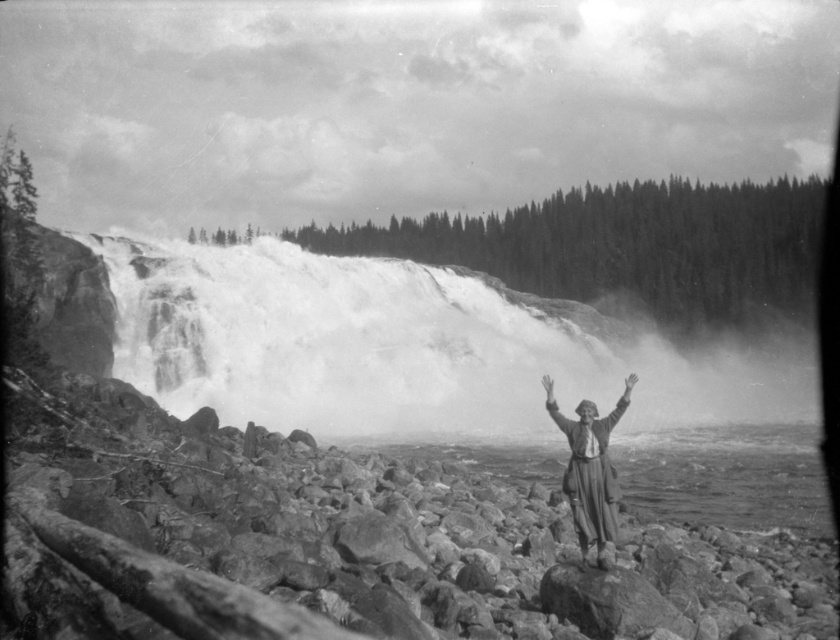
Between point (571, 518) and point (546, 378), which one is positioned behind?

The point (571, 518) is behind.

Can you confirm if smooth rock at center is positioned above white matte hand at center?

Actually, smooth rock at center is below white matte hand at center.

This screenshot has width=840, height=640. What are the coordinates of `smooth rock at center` in the screenshot? It's located at (349, 545).

Locate an element on the screen. The image size is (840, 640). smooth rock at center is located at coordinates (349, 545).

Can you confirm if clear water at center is positioned above white matte hand at center?

Incorrect, clear water at center is not positioned above white matte hand at center.

Find the location of a particular element. Image resolution: width=840 pixels, height=640 pixels. clear water at center is located at coordinates (727, 476).

What are the coordinates of `clear water at center` in the screenshot? It's located at (727, 476).

Is point (563, 605) more distant than point (762, 438)?

No.

Can you confirm if smooth rock at center is positioned to the right of clear water at center?

In fact, smooth rock at center is to the left of clear water at center.

Does point (282, 593) come closer to viewer compared to point (696, 515)?

Yes, point (282, 593) is in front of point (696, 515).

Where is `smooth rock at center`? The image size is (840, 640). smooth rock at center is located at coordinates (349, 545).